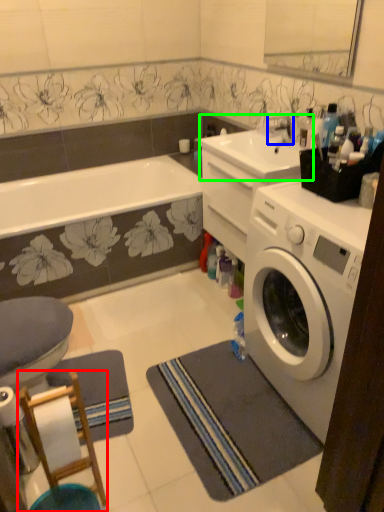
Question: Which object is positioned farthest from bar stool (highlighted by a red box)? Select from faucet (highlighted by a blue box) and sink (highlighted by a green box).

Choices:
 (A) faucet
 (B) sink

Answer: (A)